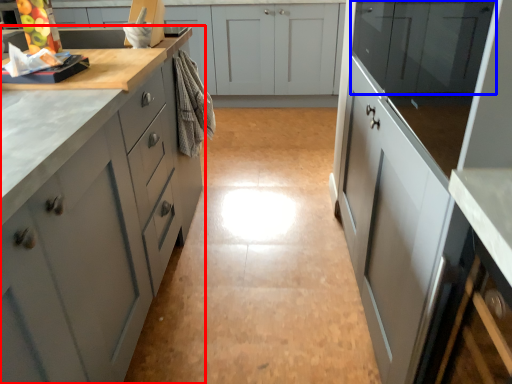
Question: Which object appears closest to the camera in this image, cabinetry (highlighted by a red box) or cabinetry (highlighted by a blue box)?

Choices:
 (A) cabinetry
 (B) cabinetry

Answer: (A)